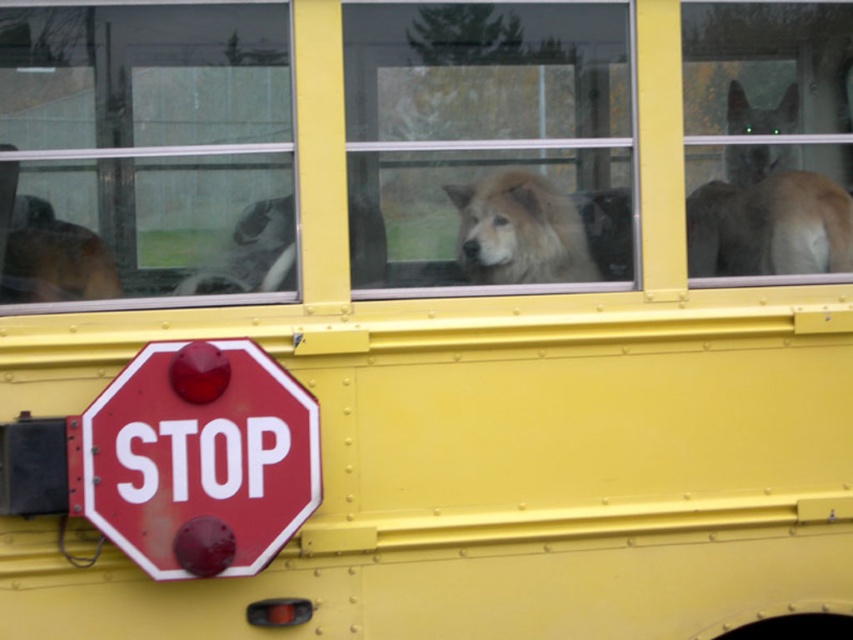
Question: Which point appears closest to the camera in this image?

Choices:
 (A) (109, 397)
 (B) (701, 116)
 (C) (527, 160)

Answer: (A)

Question: Which point is closer to the camera?

Choices:
 (A) tap(466, 211)
 (B) tap(189, 93)
 (C) tap(502, 161)
 (D) tap(763, 180)

Answer: (B)

Question: Is smooth red stop sign at lower left positioned at the back of fluffy white dog at center?

Choices:
 (A) yes
 (B) no

Answer: (B)

Question: Is transparent glass window at upper left below smooth red stop sign at lower left?

Choices:
 (A) yes
 (B) no

Answer: (B)

Question: Does smooth red stop sign at lower left appear under fluffy white dog at center?

Choices:
 (A) yes
 (B) no

Answer: (A)

Question: Which point is farther from the camera taking this photo?

Choices:
 (A) click(389, 16)
 (B) click(689, 74)
 (C) click(459, 221)
 (D) click(281, 285)

Answer: (B)